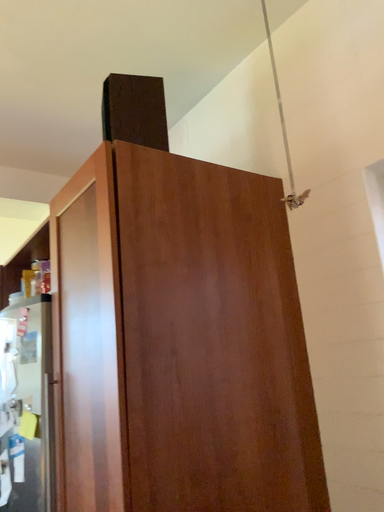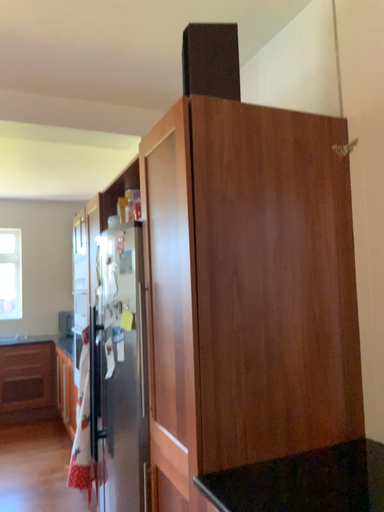
Question: Which way did the camera rotate in the video?

Choices:
 (A) rotated downward
 (B) rotated upward

Answer: (A)